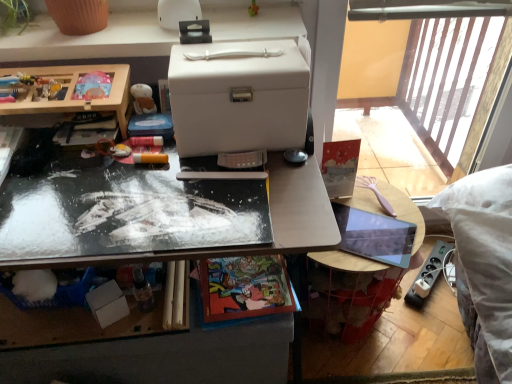
Locate an element on the screen. vacant area situated below smooth wooden table at right (from a real-world perspective) is located at coordinates (367, 239).